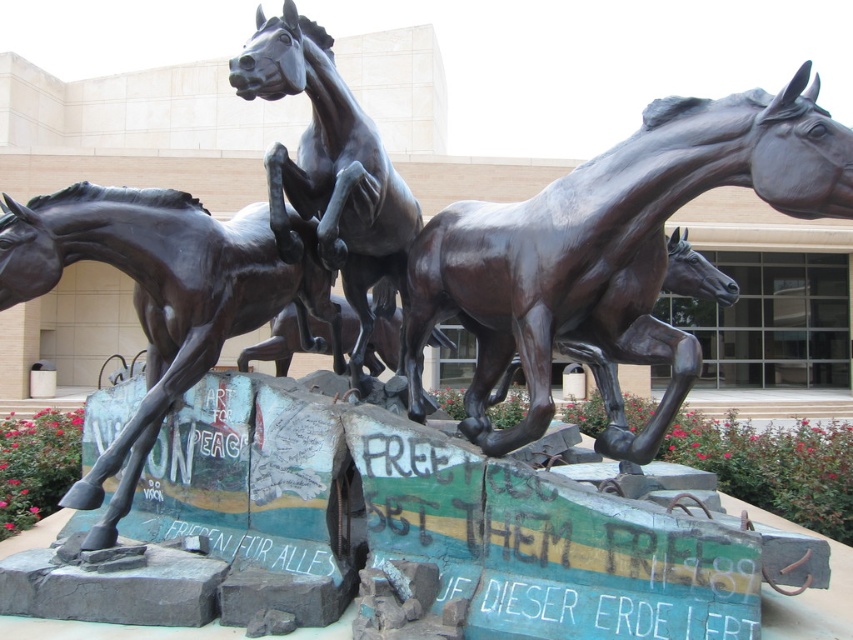
Can you confirm if shiny bronze horse at center is thinner than bronze horse at center?

No, shiny bronze horse at center is not thinner than bronze horse at center.

Is shiny bronze horse at center shorter than bronze horse at center?

Yes.

Which is in front, point (650, 196) or point (440, 340)?

Point (650, 196) is in front.

Where is `shiny bronze horse at center`? The image size is (853, 640). shiny bronze horse at center is located at coordinates (610, 253).

Based on the photo, measure the distance between bronze statue of horse at center and camera.

bronze statue of horse at center and camera are 3.51 meters apart.

Is bronze statue of horse at center positioned at the back of bronze horse at center?

No, it is in front of bronze horse at center.

Is point (204, 308) closer to viewer compared to point (312, 140)?

That is True.

Find the location of a particular element. bronze statue of horse at center is located at coordinates (161, 296).

Can you confirm if shiny bronze horse at center is thinner than bronze statue of horse at center?

In fact, shiny bronze horse at center might be wider than bronze statue of horse at center.

Is shiny bronze horse at center to the left of bronze statue of horse at center from the viewer's perspective?

No, shiny bronze horse at center is not to the left of bronze statue of horse at center.

The height and width of the screenshot is (640, 853). What are the coordinates of `shiny bronze horse at center` in the screenshot? It's located at (610, 253).